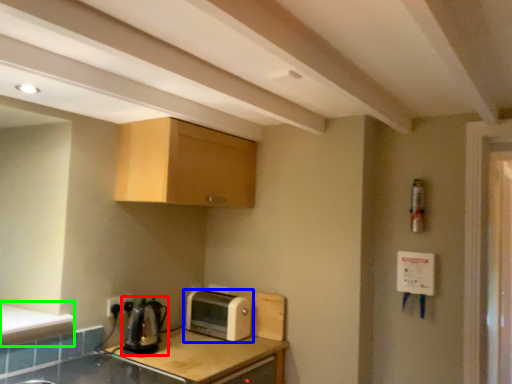
Question: Estimate the real-world distances between objects in this image. Which object is farther from tea pot (highlighted by a red box), toaster (highlighted by a blue box) or counter top (highlighted by a green box)?

Choices:
 (A) toaster
 (B) counter top

Answer: (A)